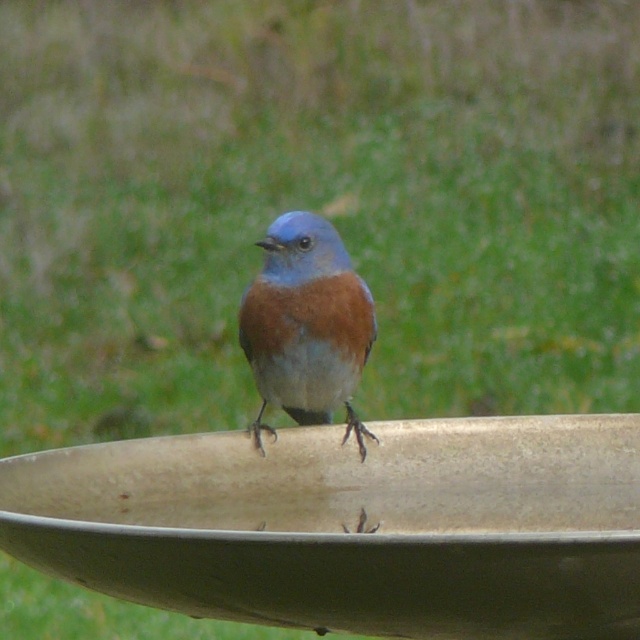
Between point (276, 573) and point (269, 339), which one is positioned in front?

Positioned in front is point (276, 573).

Is beige ceramic bird bath at center taller than blue glossy bird at center?

No.

Between point (304, 592) and point (340, 333), which one is positioned in front?

Point (304, 592)

Locate an element on the screen. This screenshot has height=640, width=640. beige ceramic bird bath at center is located at coordinates (352, 524).